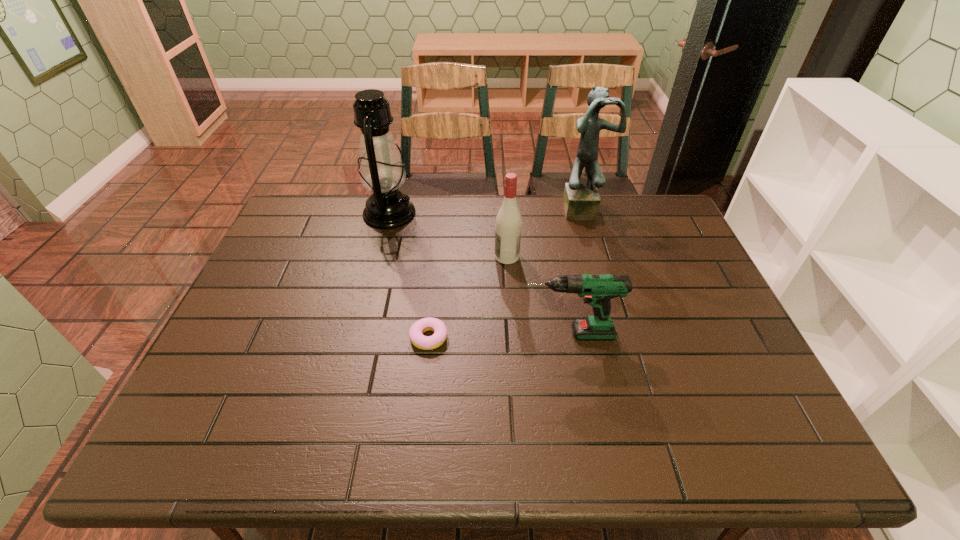
You are a GUI agent. You are given a task and a screenshot of the screen. Output one action in this format:
    pyautogui.click(x=<x>, y=<y>)
    Task: Click on the blank area at the left edge
    
    Given the screenshot: What is the action you would take?
    pyautogui.click(x=230, y=414)

Locate an element on the screen. This screenshot has height=540, width=960. free space at the right edge of the desktop is located at coordinates (724, 341).

At what (x,y) coordinates should I click in order to perform the action: click on free region at the far left corner. Please return your answer as a coordinate pair (x, y). Looking at the image, I should click on (289, 211).

I want to click on vacant space at the near left corner of the desktop, so click(x=160, y=456).

The image size is (960, 540). I want to click on vacant space that's between the sculpture and the leftmost object, so click(x=486, y=211).

This screenshot has height=540, width=960. Identify the location of free spot between the second shortest object and the third tallest object. (538, 295).

The width and height of the screenshot is (960, 540). What are the coordinates of `free area in between the sculpture and the fourth tallest object` in the screenshot? It's located at (576, 271).

The width and height of the screenshot is (960, 540). In order to click on free point between the sculpture and the second shortest object in this screenshot , I will do [x=576, y=271].

Image resolution: width=960 pixels, height=540 pixels. Find the location of `blank region between the second shortest object and the sculpture`. blank region between the second shortest object and the sculpture is located at coordinates (576, 271).

Identify the location of empty location between the sculpture and the shortest object. This screenshot has height=540, width=960. (506, 273).